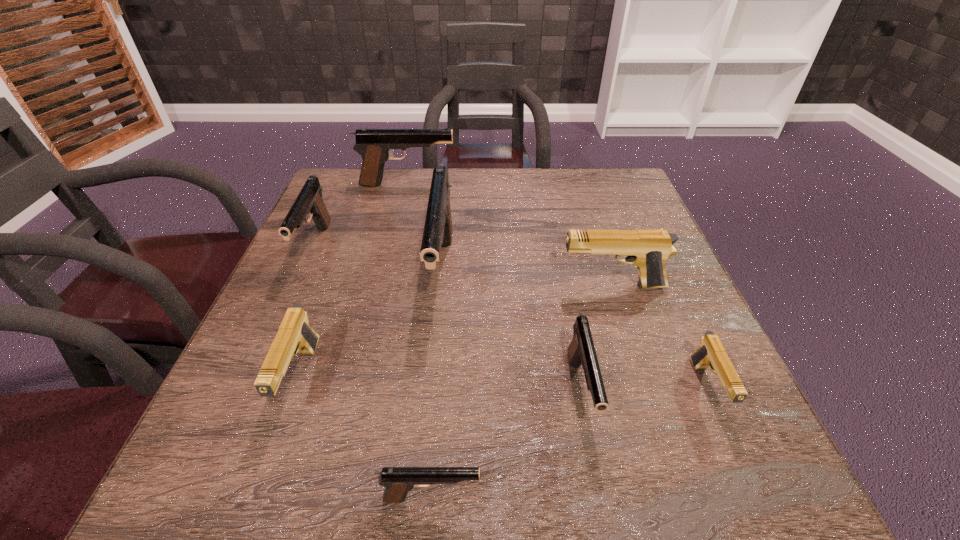
Find the location of a particular element. the nearest pistol is located at coordinates (398, 481).

At what (x,y) coordinates should I click in order to perform the action: click on free location located 0.280m at the muzzle of the farthest pistol. Please return your answer as a coordinate pair (x, y). Looking at the image, I should click on (554, 184).

Identify the location of vacant region located 0.050m at the barrel of the biggest tan pistol. (536, 286).

Locate an element on the screen. Image resolution: width=960 pixels, height=540 pixels. free space located 0.090m at the barrel of the biggest tan pistol is located at coordinates (516, 286).

This screenshot has width=960, height=540. I want to click on vacant space located at the barrel of the biggest tan pistol, so click(x=512, y=286).

Locate an element on the screen. Image resolution: width=960 pixels, height=540 pixels. vacant area situated at the muzzle of the leftmost object is located at coordinates (258, 375).

Identify the location of blank space located 0.100m at the barrel of the second biggest tan pistol. This screenshot has height=540, width=960. 259,493.

Where is `blank space located 0.070m at the muzzle of the second nearest black pistol`? This screenshot has height=540, width=960. blank space located 0.070m at the muzzle of the second nearest black pistol is located at coordinates (601, 490).

You are a GUI agent. You are given a task and a screenshot of the screen. Output one action in this format:
    pyautogui.click(x=<x>, y=<y>)
    Task: Click on the free location located at the muzzle of the nearest pistol
    
    Given the screenshot: What is the action you would take?
    pyautogui.click(x=666, y=497)

Identify the location of object positioned at the far edge. The height and width of the screenshot is (540, 960). click(x=374, y=145).